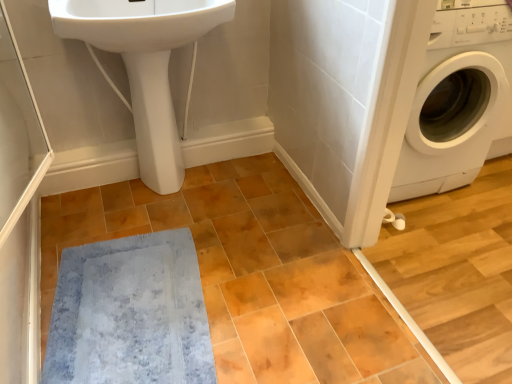
Question: Is white glossy washing machine at right taller than white glossy sink at upper left?

Choices:
 (A) no
 (B) yes

Answer: (B)

Question: Does white glossy washing machine at right lie behind white glossy sink at upper left?

Choices:
 (A) yes
 (B) no

Answer: (A)

Question: Is white glossy sink at upper left completely or partially inside white glossy washing machine at right?

Choices:
 (A) no
 (B) yes

Answer: (A)

Question: Is white glossy washing machine at right far away from white glossy sink at upper left?

Choices:
 (A) no
 (B) yes

Answer: (A)

Question: Can we say white glossy washing machine at right lies outside white glossy sink at upper left?

Choices:
 (A) yes
 (B) no

Answer: (A)

Question: Can you see white glossy washing machine at right touching white glossy sink at upper left?

Choices:
 (A) no
 (B) yes

Answer: (A)

Question: Is the position of white glossy sink at upper left less distant than that of white glossy washing machine at right?

Choices:
 (A) no
 (B) yes

Answer: (B)

Question: From the image's perspective, is white glossy sink at upper left on top of white glossy washing machine at right?

Choices:
 (A) yes
 (B) no

Answer: (A)

Question: Does white glossy sink at upper left have a larger size compared to white glossy washing machine at right?

Choices:
 (A) yes
 (B) no

Answer: (B)

Question: Considering the relative sizes of white glossy sink at upper left and white glossy washing machine at right in the image provided, is white glossy sink at upper left thinner than white glossy washing machine at right?

Choices:
 (A) yes
 (B) no

Answer: (A)

Question: Can you confirm if white glossy sink at upper left is smaller than white glossy washing machine at right?

Choices:
 (A) yes
 (B) no

Answer: (A)

Question: Is white glossy sink at upper left looking in the opposite direction of white glossy washing machine at right?

Choices:
 (A) no
 (B) yes

Answer: (A)

Question: Is the surface of blue plush bath mat at lower left in direct contact with white glossy sink at upper left?

Choices:
 (A) no
 (B) yes

Answer: (A)